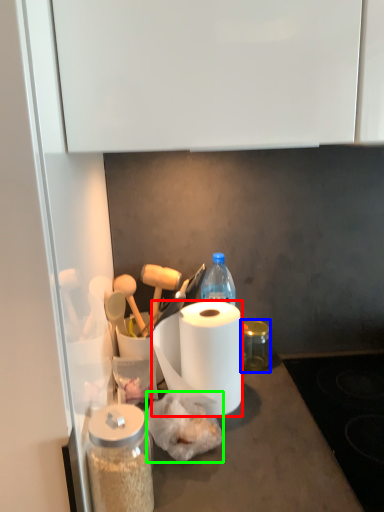
Question: Estimate the real-world distances between objects in this image. Which object is closer to paper towel (highlighted by a red box), glass jar (highlighted by a blue box) or food (highlighted by a green box)?

Choices:
 (A) glass jar
 (B) food

Answer: (B)